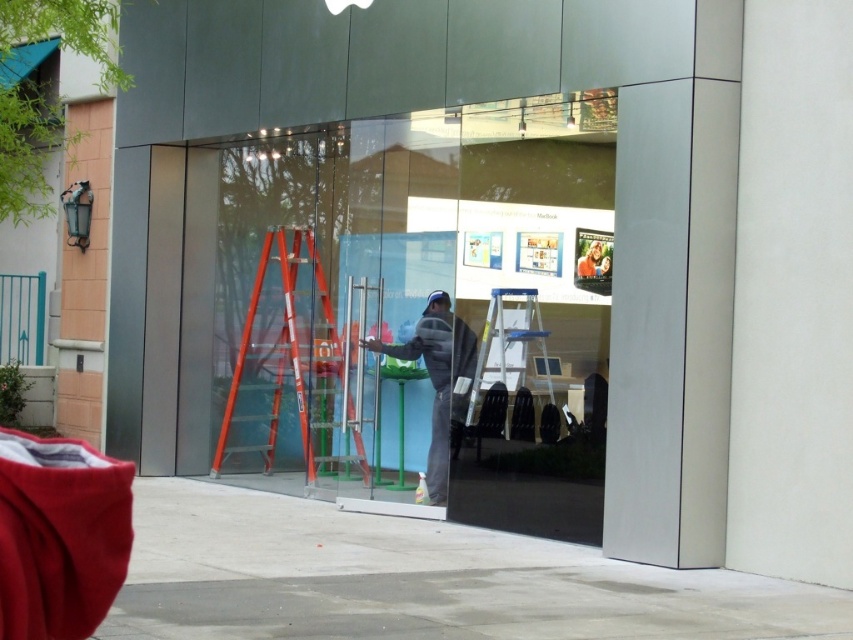
Question: Which point is closer to the camera?

Choices:
 (A) (517, 424)
 (B) (595, 129)

Answer: (B)

Question: Is transparent glass shop window at center to the right of orange fiberglass ladder at center from the viewer's perspective?

Choices:
 (A) no
 (B) yes

Answer: (A)

Question: Is gray fleece jacket at center thinner than smooth gray shirt at center?

Choices:
 (A) yes
 (B) no

Answer: (B)

Question: Does orange fiberglass ladder at center appear under smooth gray shirt at center?

Choices:
 (A) yes
 (B) no

Answer: (A)

Question: Which object is positioned farthest from the orange fiberglass ladder at center?

Choices:
 (A) gray fleece jacket at center
 (B) transparent glass shop window at center

Answer: (A)

Question: Among these points, which one is farthest from the camera?

Choices:
 (A) (587, 264)
 (B) (453, 509)
 (C) (408, 348)
 (D) (323, 355)

Answer: (D)